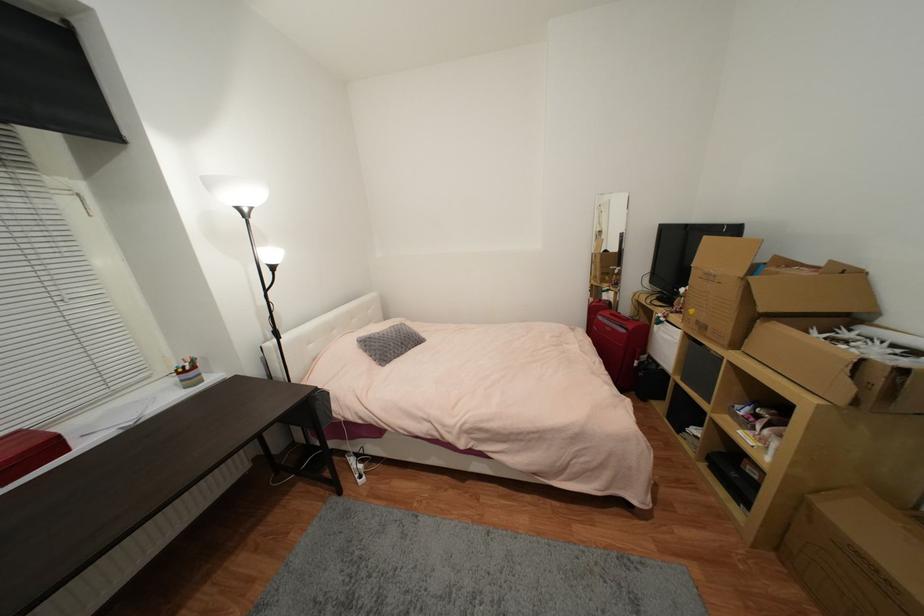
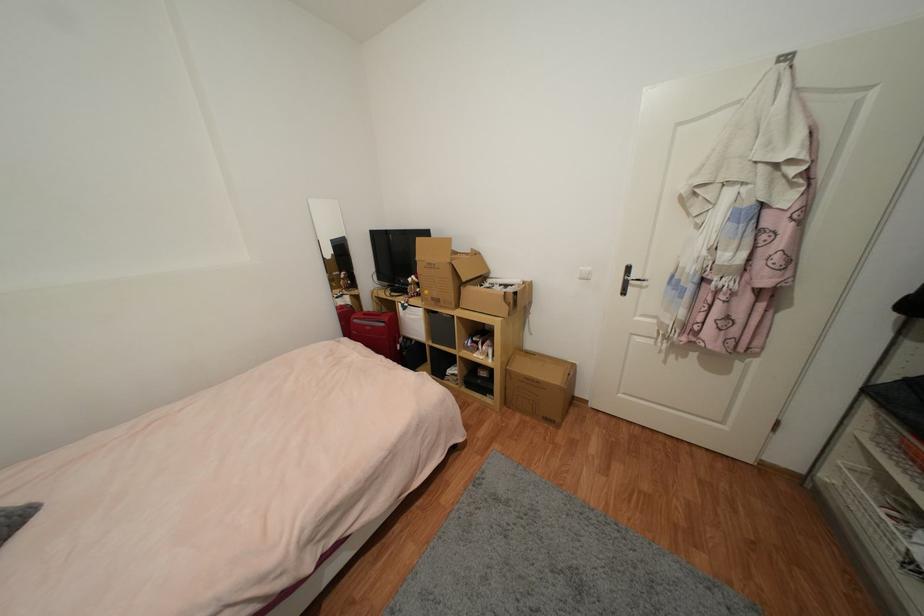
Question: How did the camera likely rotate?

Choices:
 (A) Left
 (B) Right
 (C) Up
 (D) Down

Answer: (B)